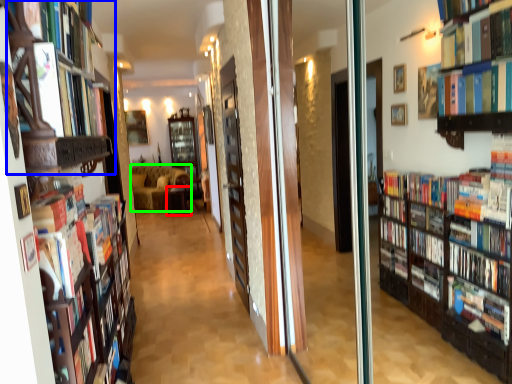
Question: Which is farther away from furniture (highlighted by a red box)? shelf (highlighted by a blue box) or couch (highlighted by a green box)?

Choices:
 (A) shelf
 (B) couch

Answer: (A)